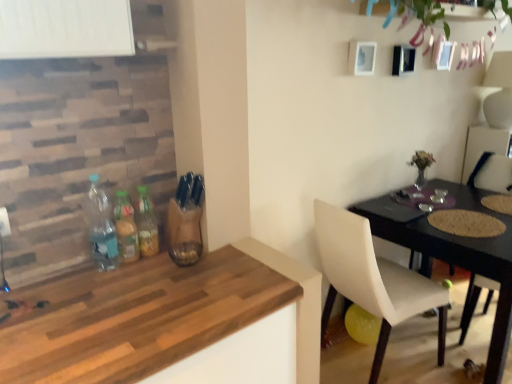
Question: In the image, is translucent glass bottles at center, the third bottle viewed from the left, positioned in front of or behind green leafy plant at upper center?

Choices:
 (A) behind
 (B) front

Answer: (B)

Question: In terms of height, does translucent glass bottles at center, the third bottle viewed from the left, look taller or shorter compared to green leafy plant at upper center?

Choices:
 (A) tall
 (B) short

Answer: (A)

Question: Estimate the real-world distances between objects in this image. Which object is closer to the black glossy table at lower right?

Choices:
 (A) transparent plastic bottle at left, the third bottle viewed from the right
 (B) white leather chair at lower right, placed as the 1th chair when sorted from left to right
 (C) translucent plastic bottle at left, which is counted as the second bottle, starting from the left
 (D) wooden table at lower left
 (E) wooden textured chair at right, positioned as the second chair in left-to-right order

Answer: (B)

Question: Estimate the real-world distances between objects in this image. Which object is closer to the translucent glass bottles at center, the third bottle viewed from the left?

Choices:
 (A) white leather chair at lower right, arranged as the second chair when viewed from the right
 (B) wooden table at lower left
 (C) black glossy table at lower right
 (D) translucent plastic bottle at left, which appears as the second bottle when viewed from the right
 (E) green leafy plant at upper center

Answer: (D)